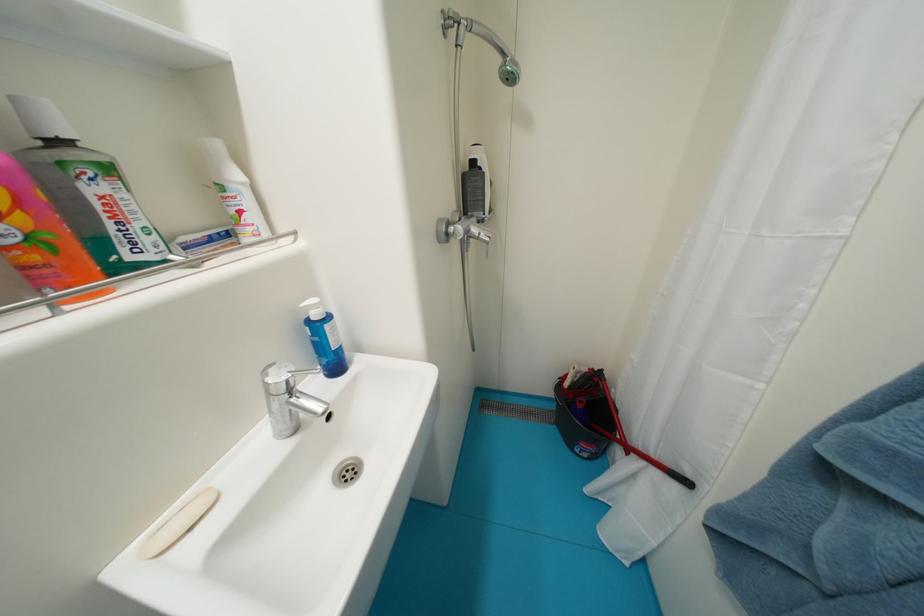
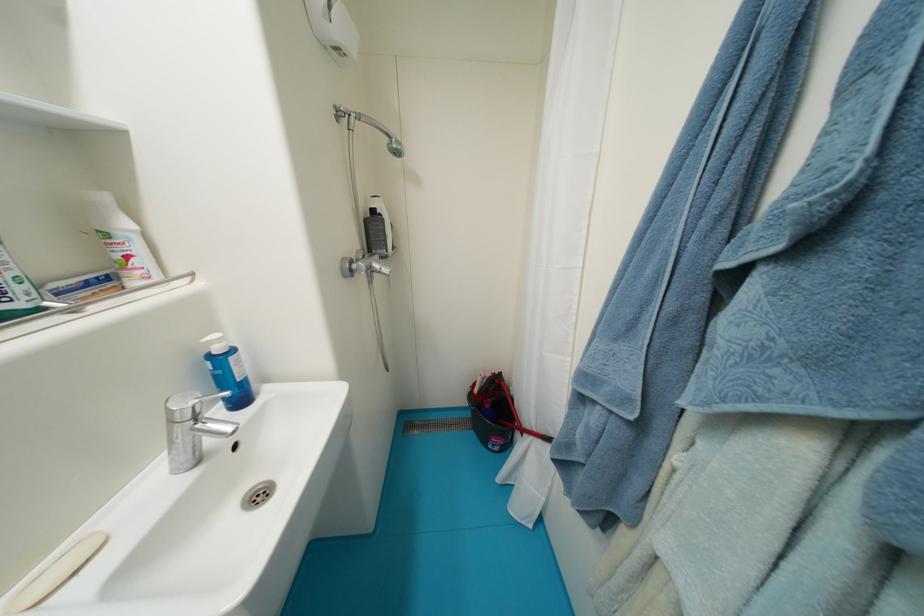
Where in the second image is the point corresponding to the point at 618,392 from the first image?

(517, 390)